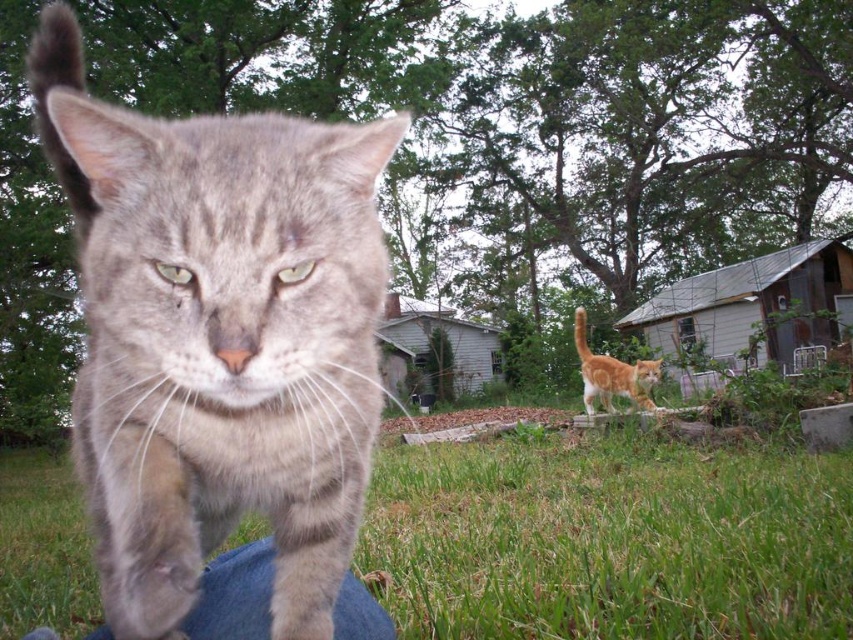
Question: Where is gray striped cat at center located in relation to green grass at lower center in the image?

Choices:
 (A) below
 (B) above

Answer: (B)

Question: Which of the following is the farthest from the observer?

Choices:
 (A) orange tabby cat at center
 (B) green grass at lower center

Answer: (A)

Question: Which of the following is the farthest from the observer?

Choices:
 (A) (642, 360)
 (B) (355, 138)

Answer: (A)

Question: Which object appears farthest from the camera in this image?

Choices:
 (A) green grass at lower center
 (B) orange tabby cat at center
 (C) gray striped cat at center

Answer: (B)

Question: Observing the image, what is the correct spatial positioning of gray striped cat at center in reference to orange tabby cat at center?

Choices:
 (A) right
 (B) left

Answer: (B)

Question: Does gray striped cat at center have a lesser width compared to orange tabby cat at center?

Choices:
 (A) yes
 (B) no

Answer: (A)